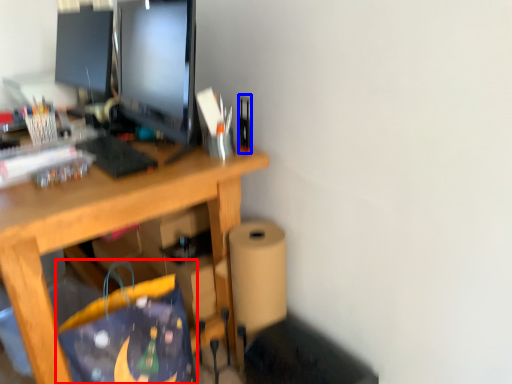
Question: Among these objects, which one is nearest to the camera, shopping bag (highlighted by a red box) or stationery (highlighted by a blue box)?

Choices:
 (A) shopping bag
 (B) stationery

Answer: (A)